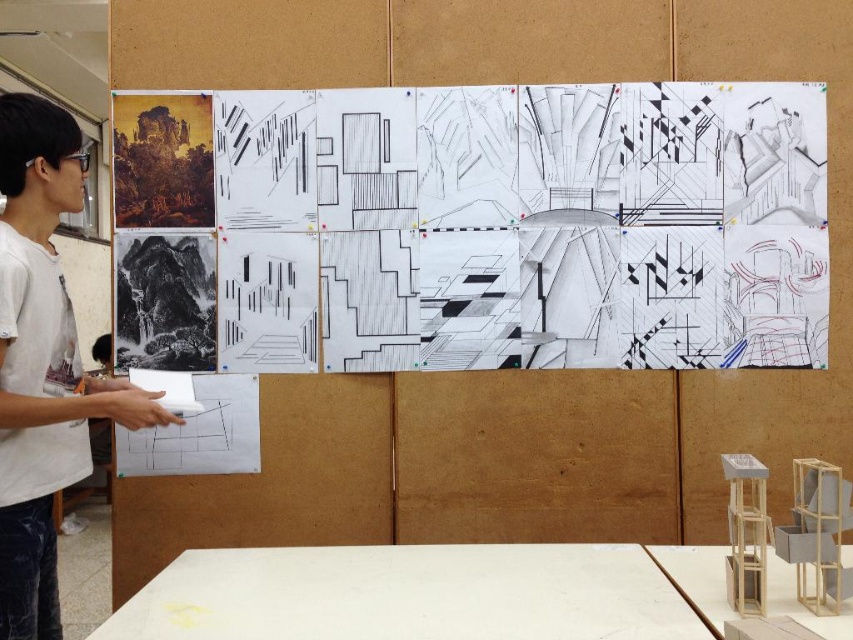
Does white paper at upper center appear under white t-shirt at left?

No.

Between point (316, 225) and point (64, 296), which one is positioned behind?

Positioned behind is point (316, 225).

Locate an element on the screen. The image size is (853, 640). white paper at upper center is located at coordinates (498, 224).